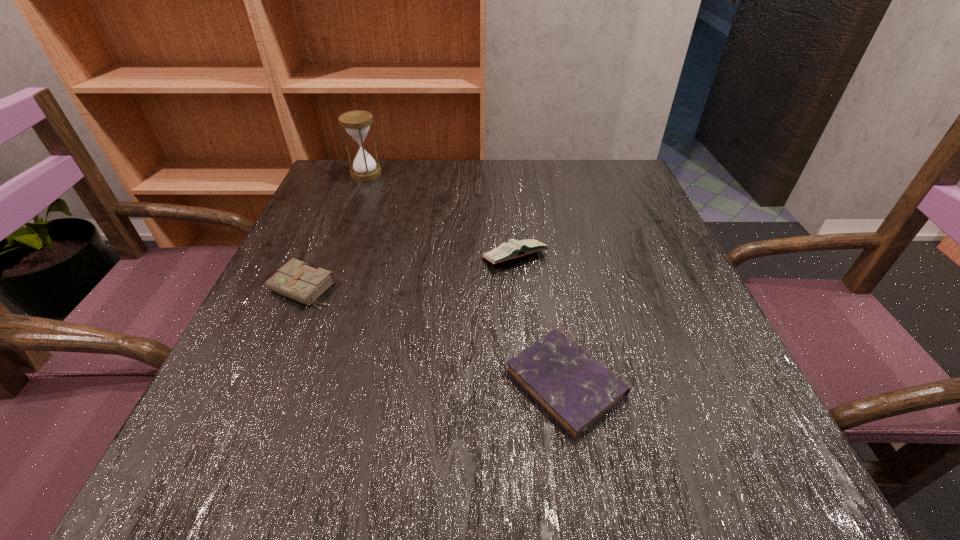
At what (x,y) coordinates should I click in order to perform the action: click on vacant space at the far left corner of the desktop. Please return your answer as a coordinate pair (x, y). Looking at the image, I should click on (348, 200).

This screenshot has height=540, width=960. Find the location of `vacant space at the far right corner of the desktop`. vacant space at the far right corner of the desktop is located at coordinates (640, 183).

Identify the location of vacant space that is in between the nearest diary and the third shortest object. (540, 320).

Locate an element on the screen. The width and height of the screenshot is (960, 540). free spot between the second tallest diary and the tallest object is located at coordinates (334, 231).

The height and width of the screenshot is (540, 960). I want to click on vacant space that's between the second shortest object and the farthest object, so click(x=334, y=231).

I want to click on free area in between the second shortest diary and the nearest object, so click(x=434, y=335).

Where is `vacant area that lies between the farthest object and the tallest diary`? The height and width of the screenshot is (540, 960). vacant area that lies between the farthest object and the tallest diary is located at coordinates (441, 215).

This screenshot has width=960, height=540. In order to click on free area in between the leftmost diary and the farthest object in this screenshot , I will do `click(334, 231)`.

Image resolution: width=960 pixels, height=540 pixels. Identify the location of free space that is in between the hourglass and the second tallest object. (441, 215).

At what (x,y) coordinates should I click in order to perform the action: click on free space that is in between the third shortest object and the nearest object. Please return your answer as a coordinate pair (x, y). This screenshot has height=540, width=960. Looking at the image, I should click on (540, 320).